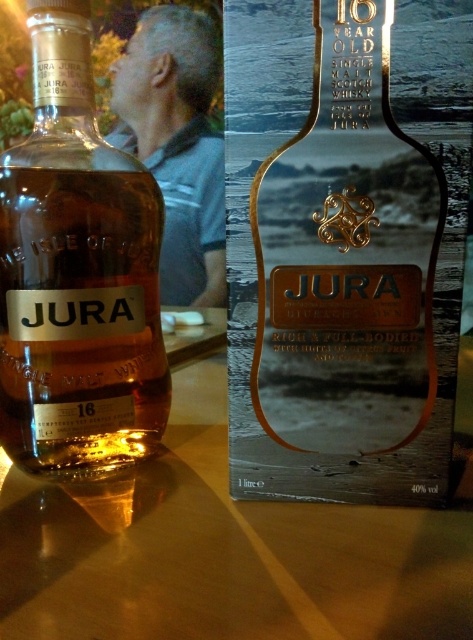
You are designing a virtual shelf layout for an online store. The shelf is 1 meter wide and 1.5 meters tall. You need to place the gold metallic bottle at center at a specific coordinate. According to the image, where should you place it?

The gold metallic bottle at center should be placed at coordinate point (340, 257) on the shelf.

In the scene shown: You are a customer looking at the Jura 16 Year Old Whisky display. You see a gold metallic bottle at center and a matte glass bottle at center. Which one is positioned lower in the display?

The gold metallic bottle at center is located below the matte glass bottle at center, so it is positioned lower in the display.

You are trying to determine which bottle is closer to you. You see a gold metallic bottle at center and a matte glass bottle at center. Which one is closer?

The gold metallic bottle at center is closer because it is in front of the matte glass bottle at center.